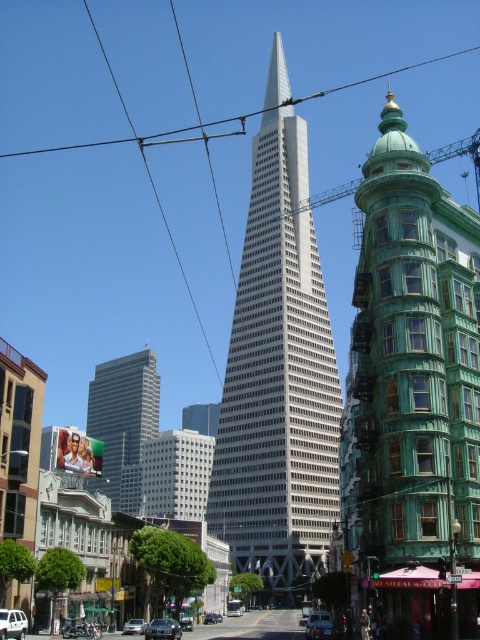
Is green glass skyscraper at center bigger than shiny silver sedan at center?

Yes.

Does green glass skyscraper at center have a greater width compared to shiny silver sedan at center?

Yes.

I want to click on green glass skyscraper at center, so click(123, 420).

Between green matte building at center and green glass skyscraper at center, which one is positioned higher?

green matte building at center is above.

Find the location of `green matte building at center`. green matte building at center is located at coordinates click(x=412, y=394).

Who is higher up, white glass skyscraper at center or metallic silver car at center?

white glass skyscraper at center is above.

Can you confirm if white glass skyscraper at center is thinner than metallic silver car at center?

In fact, white glass skyscraper at center might be wider than metallic silver car at center.

Who is more distant from viewer, (208, 518) or (208, 620)?

The point (208, 518) is behind.

In order to click on white glass skyscraper at center in this screenshot , I will do `click(277, 371)`.